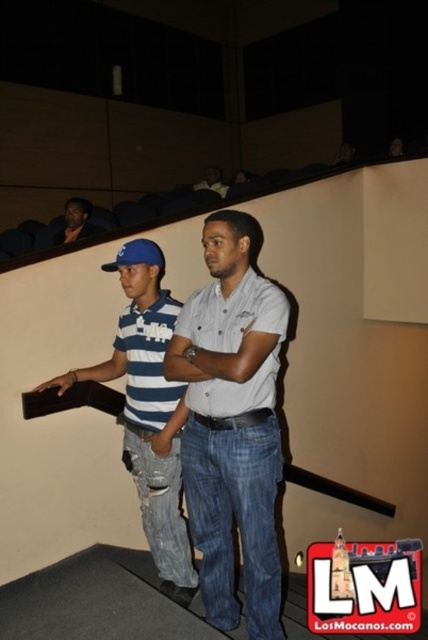
The width and height of the screenshot is (428, 640). What do you see at coordinates (232, 422) in the screenshot? I see `light blue denim jeans at center` at bounding box center [232, 422].

Can you confirm if light blue denim jeans at center is thinner than matte black shirt at upper center?

Incorrect, light blue denim jeans at center's width is not less than matte black shirt at upper center's.

Does point (198, 314) come behind point (214, 189)?

No.

The image size is (428, 640). I want to click on light blue denim jeans at center, so click(x=232, y=422).

Can you confirm if blue striped shirt at center is thinner than matte black jacket at upper left?

In fact, blue striped shirt at center might be wider than matte black jacket at upper left.

The height and width of the screenshot is (640, 428). What do you see at coordinates (148, 410) in the screenshot?
I see `blue striped shirt at center` at bounding box center [148, 410].

Where is `blue striped shirt at center`? blue striped shirt at center is located at coordinates (148, 410).

Is blue striped shirt at center positioned at the back of matte black shirt at upper center?

No, blue striped shirt at center is in front of matte black shirt at upper center.

Who is positioned more to the right, blue striped shirt at center or matte black shirt at upper center?

matte black shirt at upper center

Is point (142, 394) more distant than point (205, 173)?

No, it is not.

Image resolution: width=428 pixels, height=640 pixels. Identify the location of blue striped shirt at center. (148, 410).